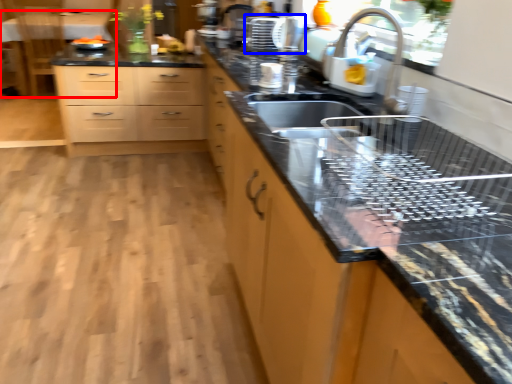
Question: Which of the following is the farthest to the observer, table (highlighted by a red box) or appliance (highlighted by a blue box)?

Choices:
 (A) table
 (B) appliance

Answer: (A)